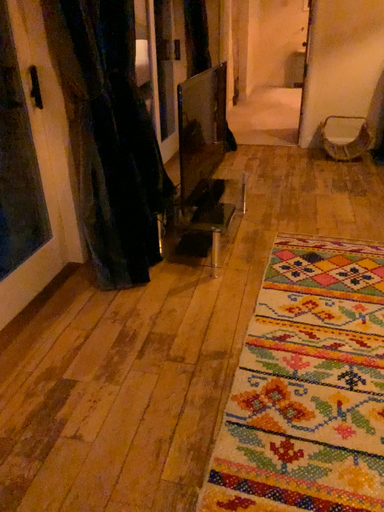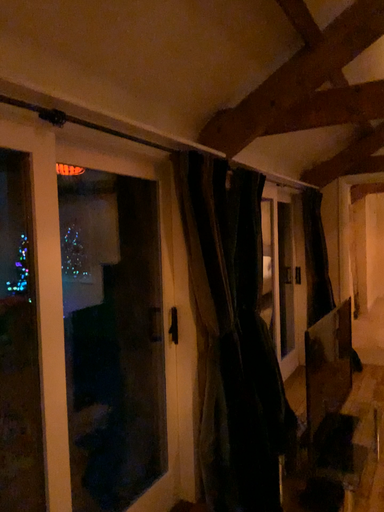
Question: Which way did the camera rotate in the video?

Choices:
 (A) rotated left
 (B) rotated right

Answer: (A)